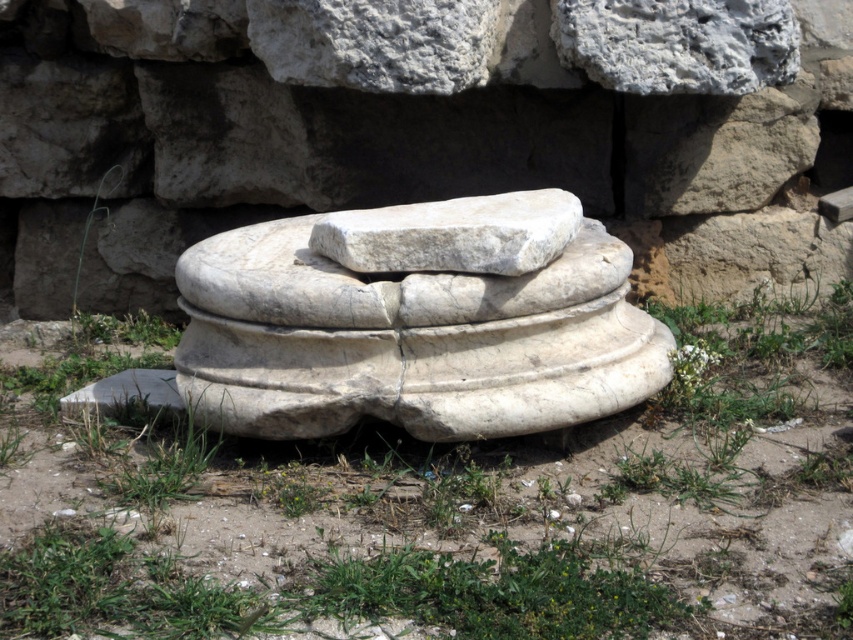
Between green grass at center and white marble sculpture at center, which one appears on the right side from the viewer's perspective?

white marble sculpture at center

Between green grass at center and white marble sculpture at center, which one has more height?

Standing taller between the two is green grass at center.

Is point (138, 580) positioned in front of point (195, 333)?

That is True.

Where is `green grass at center`? The height and width of the screenshot is (640, 853). green grass at center is located at coordinates (437, 504).